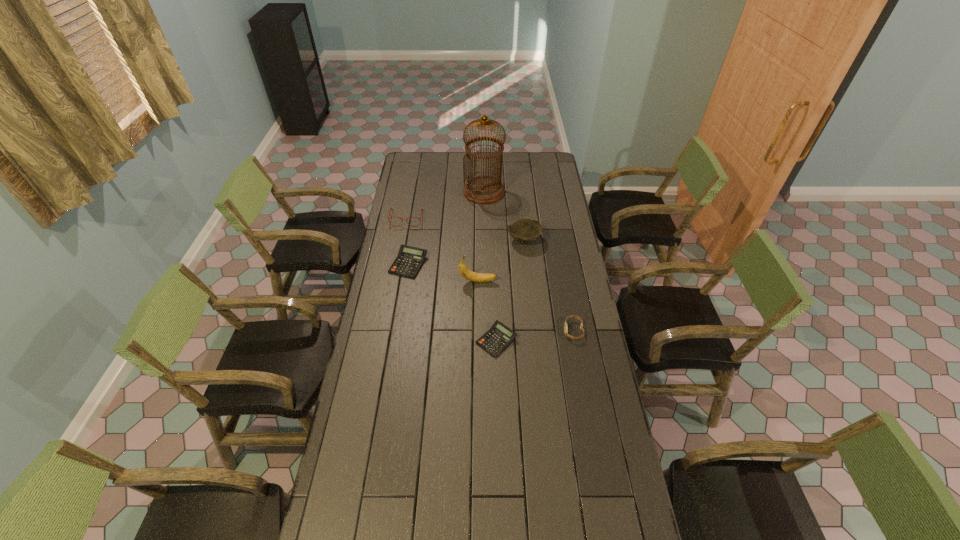
In order to click on watch in this screenshot , I will do `click(565, 325)`.

The image size is (960, 540). Identify the location of free spot located on the right of the left calculator. (511, 264).

This screenshot has width=960, height=540. Find the location of `vacant point located on the back of the right calculator`. vacant point located on the back of the right calculator is located at coordinates (x=494, y=275).

At what (x,y) coordinates should I click in order to perform the action: click on vacant position located on the front-facing side of the birdcage. Please return your answer as a coordinate pair (x, y). Looking at the image, I should click on (485, 249).

Find the location of a particular element. The width and height of the screenshot is (960, 540). vacant space located 0.120m on the left of the fifth shortest object is located at coordinates (483, 240).

Where is `blank space located 0.220m on the face of the second farthest object`? The height and width of the screenshot is (540, 960). blank space located 0.220m on the face of the second farthest object is located at coordinates (399, 256).

Locate an element on the screen. free space located at the start of the peel on the banana is located at coordinates (515, 281).

Locate an element on the screen. This screenshot has width=960, height=540. free spot located 0.140m on the face of the rightmost object is located at coordinates (529, 330).

The width and height of the screenshot is (960, 540). I want to click on free space located on the face of the rightmost object, so click(x=482, y=330).

The image size is (960, 540). What are the coordinates of `free space located 0.080m on the face of the rightmost object` in the screenshot? It's located at (544, 330).